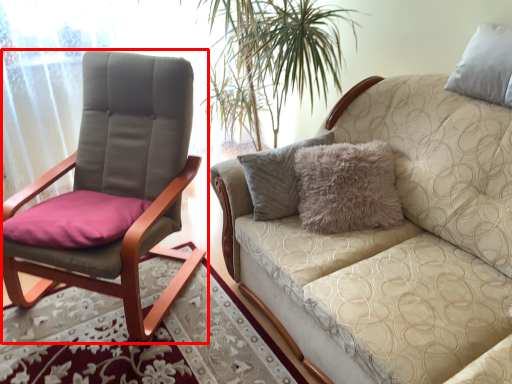
Question: Where is chair (annotated by the red box) located in relation to studio couch in the image?

Choices:
 (A) left
 (B) right

Answer: (A)